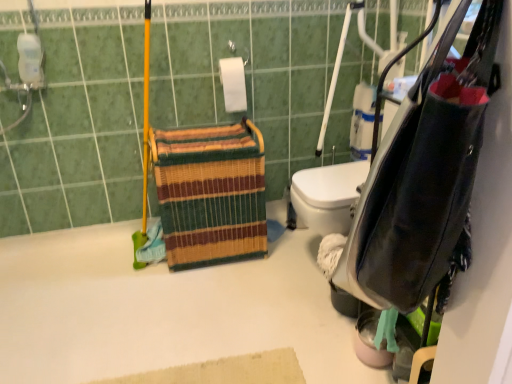
Question: From a real-world perspective, is multicolored woven basket at center located beneath leather-like black bag at right?

Choices:
 (A) yes
 (B) no

Answer: (A)

Question: Can you confirm if multicolored woven basket at center is wider than leather-like black bag at right?

Choices:
 (A) yes
 (B) no

Answer: (A)

Question: From a real-world perspective, is multicolored woven basket at center on leather-like black bag at right?

Choices:
 (A) no
 (B) yes

Answer: (A)

Question: Can you confirm if multicolored woven basket at center is bigger than leather-like black bag at right?

Choices:
 (A) yes
 (B) no

Answer: (A)

Question: Can you confirm if multicolored woven basket at center is shorter than leather-like black bag at right?

Choices:
 (A) no
 (B) yes

Answer: (A)

Question: Is multicolored woven basket at center facing away from leather-like black bag at right?

Choices:
 (A) no
 (B) yes

Answer: (A)

Question: Is leather-like black bag at right placed right next to multicolored woven basket at center?

Choices:
 (A) no
 (B) yes

Answer: (A)

Question: Is leather-like black bag at right oriented away from multicolored woven basket at center?

Choices:
 (A) yes
 (B) no

Answer: (B)

Question: Is leather-like black bag at right aimed at multicolored woven basket at center?

Choices:
 (A) no
 (B) yes

Answer: (B)

Question: Is leather-like black bag at right positioned far away from multicolored woven basket at center?

Choices:
 (A) yes
 (B) no

Answer: (A)

Question: Is leather-like black bag at right further to camera compared to multicolored woven basket at center?

Choices:
 (A) no
 (B) yes

Answer: (A)

Question: Is leather-like black bag at right thinner than multicolored woven basket at center?

Choices:
 (A) no
 (B) yes

Answer: (B)

Question: From the image's perspective, is white matte bath at upper left beneath multicolored woven basket at center?

Choices:
 (A) no
 (B) yes

Answer: (B)